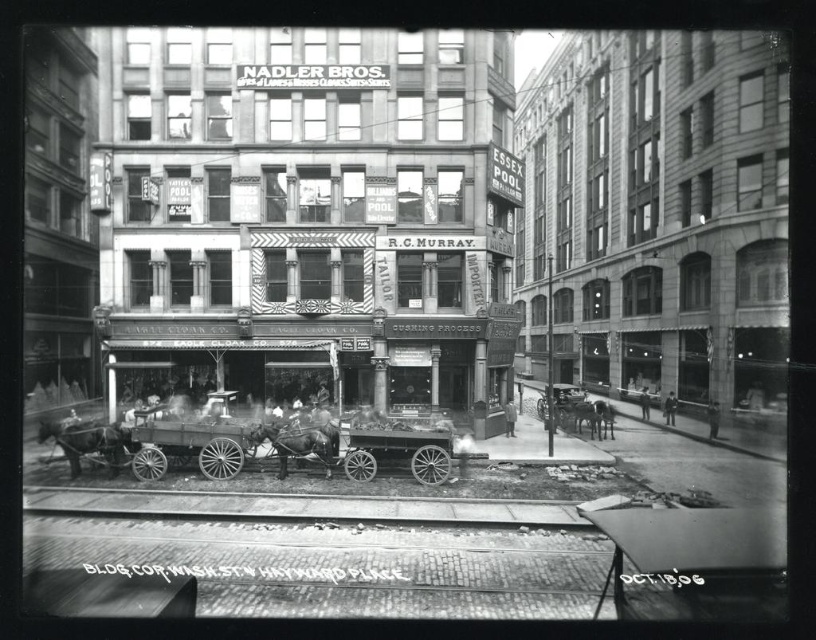
Question: Does brown glossy horse at lower left appear over brown leather horse at center?

Choices:
 (A) yes
 (B) no

Answer: (A)

Question: Which object is farther from the camera taking this photo?

Choices:
 (A) brown leather horse at center
 (B) brown glossy horse at lower left

Answer: (B)

Question: Among these points, which one is nearest to the camera?

Choices:
 (A) (69, 433)
 (B) (296, 442)

Answer: (B)

Question: Can you confirm if brown glossy horse at lower left is smaller than brown leather horse at center?

Choices:
 (A) yes
 (B) no

Answer: (A)

Question: Estimate the real-world distances between objects in this image. Which object is farther from the brown glossy horse at lower left?

Choices:
 (A) brown leather horse at center
 (B) gray matte horse at center

Answer: (B)

Question: Is brown leather horse at center bigger than gray matte horse at center?

Choices:
 (A) yes
 (B) no

Answer: (B)